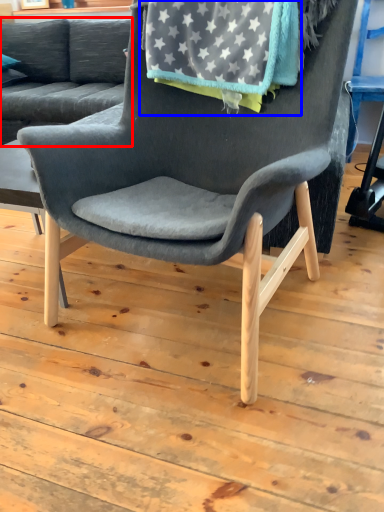
Question: Which of the following is the farthest to the observer, studio couch (highlighted by a red box) or blanket (highlighted by a blue box)?

Choices:
 (A) studio couch
 (B) blanket

Answer: (A)